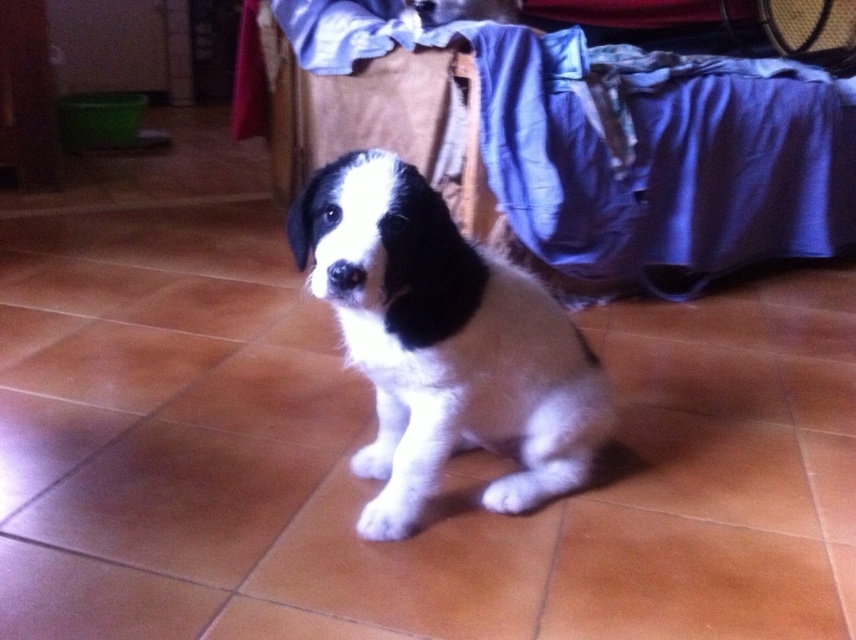
Question: Does white fur dog at center have a lesser width compared to white fluffy paw at center?

Choices:
 (A) yes
 (B) no

Answer: (B)

Question: Does white fluffy paw at center appear under white fur paw at center?

Choices:
 (A) no
 (B) yes

Answer: (B)

Question: Which object is positioned farthest from the white fluffy paw at center?

Choices:
 (A) white fur paw at center
 (B) white fur dog at center

Answer: (B)

Question: Based on their relative distances, which object is nearer to the white fluffy paw at center?

Choices:
 (A) white fur paw at center
 (B) white fur dog at center

Answer: (A)

Question: Can you confirm if white fur dog at center is positioned below white fluffy paw at center?

Choices:
 (A) no
 (B) yes

Answer: (A)

Question: Which point appears farthest from the camera in this image?

Choices:
 (A) (455, 300)
 (B) (406, 529)
 (C) (391, 448)

Answer: (C)